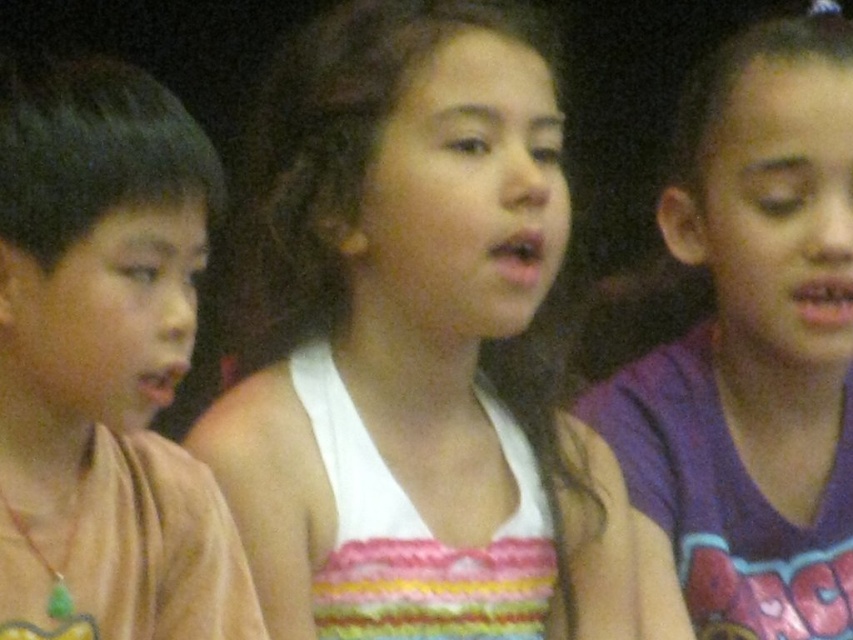
Question: Which is farther from the purple cotton shirt at right?

Choices:
 (A) brown cotton shirt at left
 (B) white knitted tank top at center

Answer: (A)

Question: Is white knitted tank top at center smaller than brown cotton shirt at left?

Choices:
 (A) yes
 (B) no

Answer: (B)

Question: Is white knitted tank top at center closer to the viewer compared to brown cotton shirt at left?

Choices:
 (A) yes
 (B) no

Answer: (B)

Question: Considering the real-world distances, which object is farthest from the purple cotton shirt at right?

Choices:
 (A) white knitted tank top at center
 (B) brown cotton shirt at left

Answer: (B)

Question: Which point is closer to the camera?

Choices:
 (A) (428, 227)
 (B) (668, 435)

Answer: (A)

Question: Does white knitted tank top at center appear over purple cotton shirt at right?

Choices:
 (A) yes
 (B) no

Answer: (A)